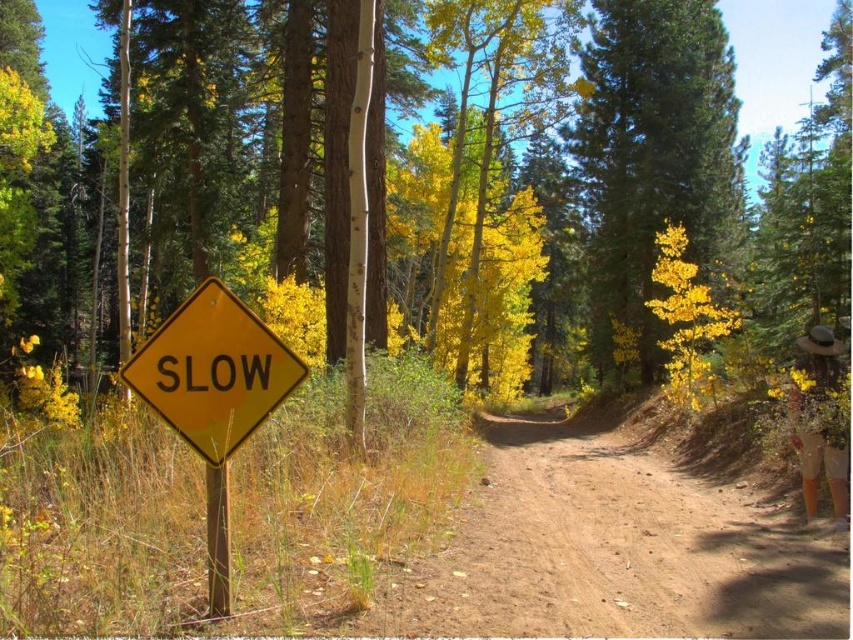
Does brown dirt track at center have a larger size compared to yellow-green leaves at center?

Actually, brown dirt track at center might be smaller than yellow-green leaves at center.

Who is positioned more to the left, brown dirt track at center or yellow-green leaves at center?

yellow-green leaves at center

Who is more forward, (589, 454) or (776, 80)?

Point (589, 454)

This screenshot has width=853, height=640. I want to click on brown dirt track at center, so click(x=614, y=548).

Does point (596, 595) come closer to viewer compared to point (180, 378)?

No, it is not.

Which is in front, point (668, 468) or point (161, 356)?

Positioned in front is point (161, 356).

Image resolution: width=853 pixels, height=640 pixels. Describe the element at coordinates (614, 548) in the screenshot. I see `brown dirt track at center` at that location.

Identify the location of brown dirt track at center. The height and width of the screenshot is (640, 853). (614, 548).

Does yellow-green foliage at center appear on the left side of yellow matte diamond at center?

Incorrect, yellow-green foliage at center is not on the left side of yellow matte diamond at center.

Is yellow-green foliage at center below yellow matte diamond at center?

No.

Locate an element on the screen. This screenshot has height=640, width=853. yellow-green foliage at center is located at coordinates (650, 157).